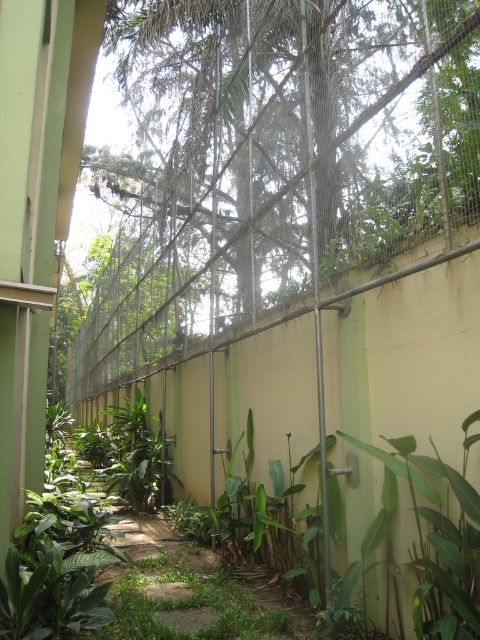
Does green grassy path at center have a larger size compared to green leafy plants at lower left?

Yes, green grassy path at center is bigger than green leafy plants at lower left.

How much distance is there between green grassy path at center and green leafy plants at lower left?

They are 1.52 meters apart.

Who is more distant from viewer, (116, 609) or (464, 552)?

Point (116, 609)

Image resolution: width=480 pixels, height=640 pixels. I want to click on green grassy path at center, so click(193, 588).